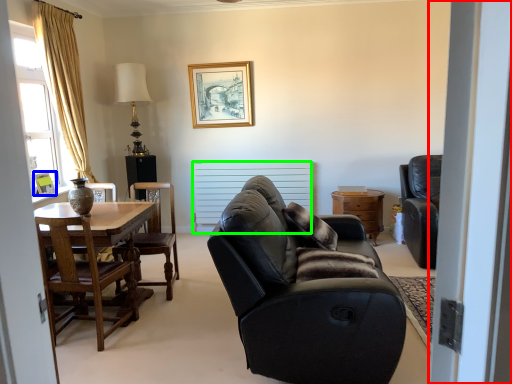
Question: Which is nearer to the screen door (highlighted by a red box)? picture frame (highlighted by a blue box) or radiator (highlighted by a green box).

Choices:
 (A) picture frame
 (B) radiator

Answer: (A)